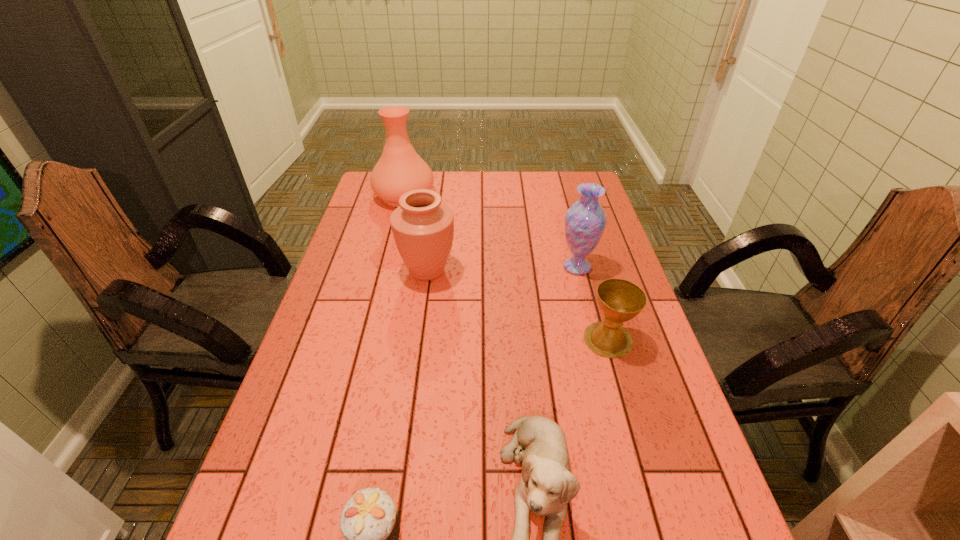
Find the location of a particular element. Image resolution: width=960 pixels, height=540 pixels. chalice located at the right edge is located at coordinates (619, 300).

This screenshot has height=540, width=960. What are the coordinates of `object located in the far left corner section of the desktop` in the screenshot? It's located at (400, 169).

I want to click on free region at the far edge of the desktop, so click(x=460, y=185).

Locate an element on the screen. The width and height of the screenshot is (960, 540). vacant area at the left edge of the desktop is located at coordinates (386, 253).

Locate an element on the screen. Image resolution: width=960 pixels, height=540 pixels. vacant space at the right edge of the desktop is located at coordinates (561, 207).

Locate an element on the screen. This screenshot has width=960, height=540. blank region between the rightmost vase and the chalice is located at coordinates (592, 303).

Locate an element on the screen. empty space between the tallest vase and the rightmost vase is located at coordinates (491, 232).

This screenshot has height=540, width=960. What are the coordinates of `empty space between the rightmost vase and the third nearest object` in the screenshot? It's located at (592, 303).

This screenshot has height=540, width=960. Find the location of `object that is the fifth closest to the shortest object`. object that is the fifth closest to the shortest object is located at coordinates (400, 169).

Identify which object is the fifth closest to the third nearest object. Please provide its 2D coordinates. Your answer should be formatted as a tuple, i.e. [(x, y)], where the tuple contains the x and y coordinates of a point satisfying the conditions above.

[(400, 169)]